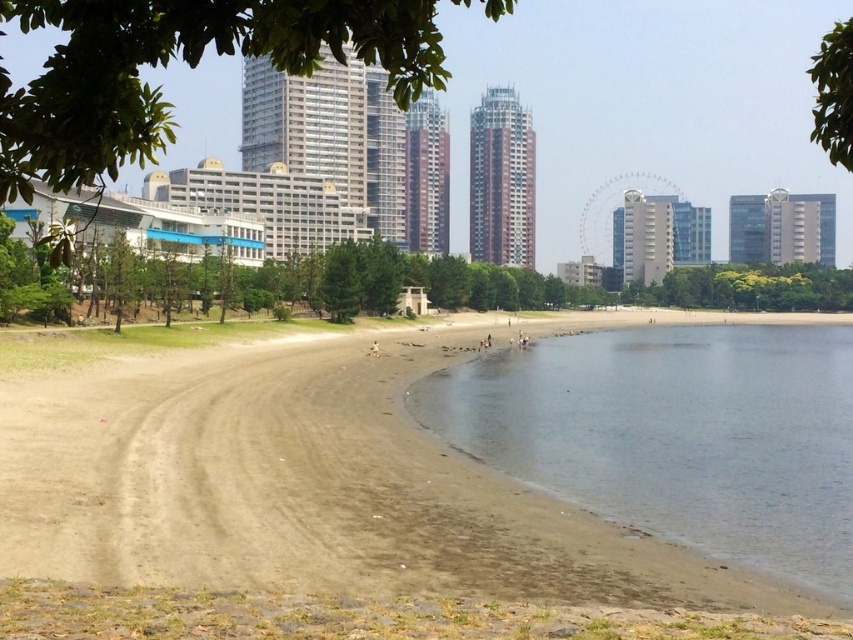
You are standing on the beach and want to walk from the brown sand at lower left to the clear water at lower right. Which direction should you move to reach the water?

You should move downward from the brown sand at lower left to reach the clear water at lower right since the brown sand is located above the clear water.

You are standing on the beach and see a point marked at coordinates (x=183, y=61). What object is located at that point?

The point at coordinates (x=183, y=61) corresponds to the green leafy tree at upper center.

You are standing on the beach and want to walk to the clear water at lower right. Which direction should you move relative to the brown sand at lower left?

You should move to the right relative to the brown sand at lower left to reach the clear water at lower right since the brown sand at lower left is positioned on the left side of clear water at lower right.